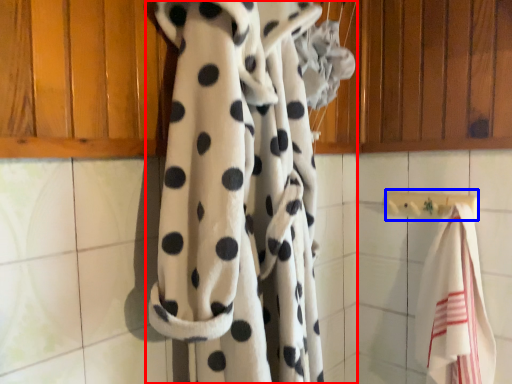
Question: Which object is further to the camera taking this photo, curtain (highlighted by a red box) or towel bar (highlighted by a blue box)?

Choices:
 (A) curtain
 (B) towel bar

Answer: (B)